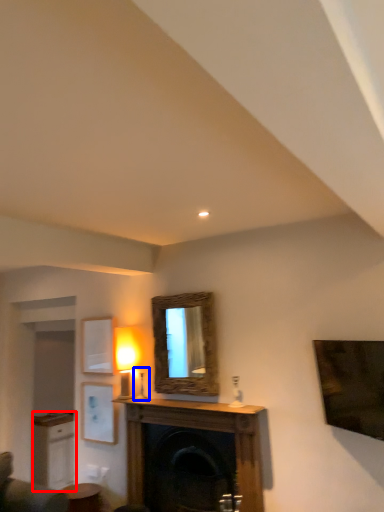
Question: Which object appears farthest to the camera in this image, cabinetry (highlighted by a red box) or table lamp (highlighted by a blue box)?

Choices:
 (A) cabinetry
 (B) table lamp

Answer: (A)